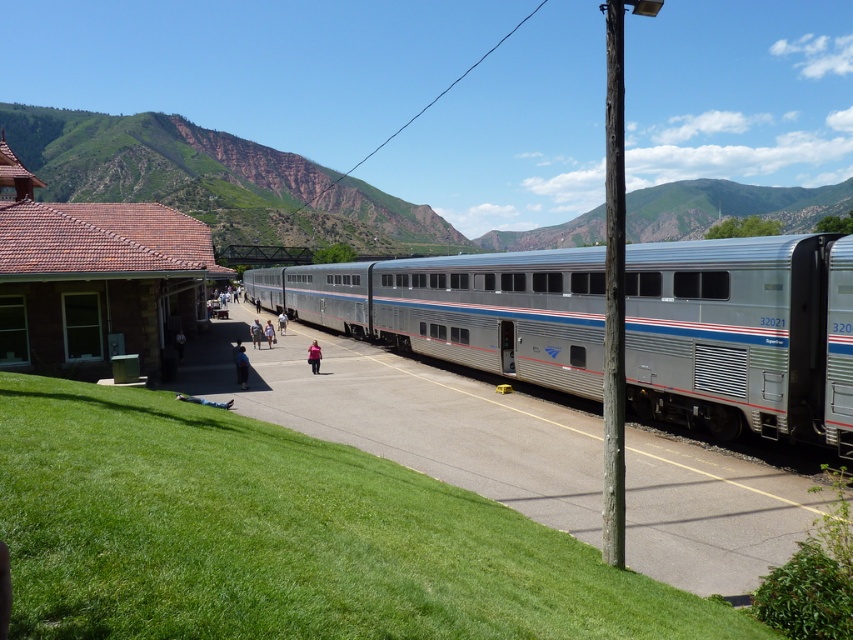
Question: Which object is positioned farthest from the brown stone railway station at left?

Choices:
 (A) green grassy hillside at upper left
 (B) silver/aluminum train car at center

Answer: (A)

Question: Which of the following is the closest to the observer?

Choices:
 (A) green grassy hillside at upper left
 (B) silver/aluminum train car at center

Answer: (B)

Question: Does green grassy hillside at upper left have a larger size compared to brown stone railway station at left?

Choices:
 (A) no
 (B) yes

Answer: (B)

Question: Does silver/aluminum train car at center have a larger size compared to green grassy hillside at upper left?

Choices:
 (A) yes
 (B) no

Answer: (B)

Question: Which point appears closest to the camera in this image?

Choices:
 (A) (20, 356)
 (B) (540, 385)

Answer: (B)

Question: Is silver/aluminum train car at center behind brown stone railway station at left?

Choices:
 (A) no
 (B) yes

Answer: (A)